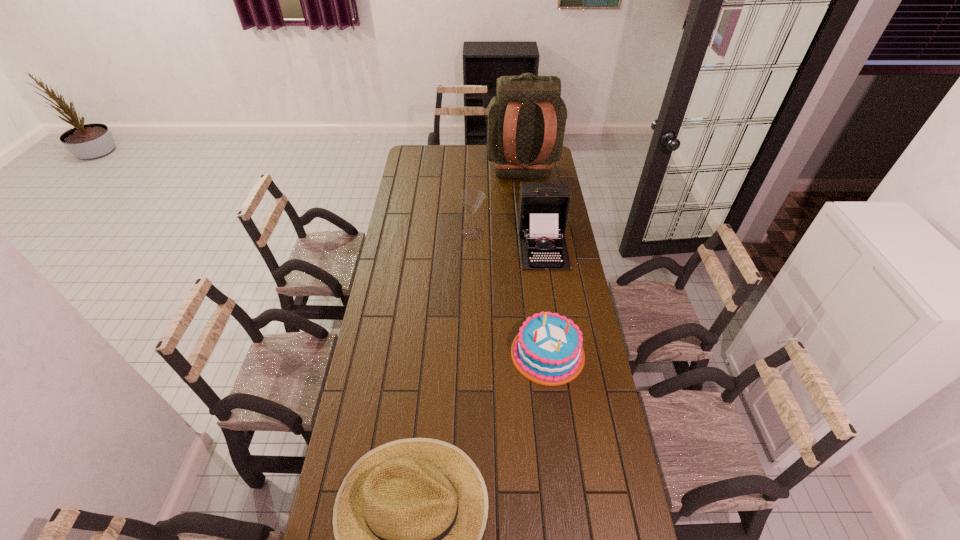
Image resolution: width=960 pixels, height=540 pixels. Find the location of `backpack that is at the right edge`. backpack that is at the right edge is located at coordinates (526, 121).

This screenshot has height=540, width=960. Identify the location of typewriter located at the right edge. (543, 209).

This screenshot has height=540, width=960. I want to click on birthday cake at the right edge, so click(x=548, y=349).

I want to click on object that is at the far right corner, so click(526, 121).

You are a GUI agent. You are given a task and a screenshot of the screen. Output one action in this format:
    pyautogui.click(x=<x>, y=<y>)
    Task: Click on the free space at the far edge
    
    Given the screenshot: What is the action you would take?
    pyautogui.click(x=457, y=157)

I want to click on vacant space at the left edge, so click(x=395, y=219).

In the image, there is a desktop. Where is `free space at the right edge`? free space at the right edge is located at coordinates (577, 389).

Find the location of a particular element. vacant area between the third tallest object and the birthday cake is located at coordinates (510, 293).

This screenshot has width=960, height=540. What are the coordinates of `empty location between the flute glass and the birthday cake` in the screenshot? It's located at (510, 293).

The width and height of the screenshot is (960, 540). In order to click on empty space that is in between the birthday cake and the third tallest object in this screenshot , I will do `click(510, 293)`.